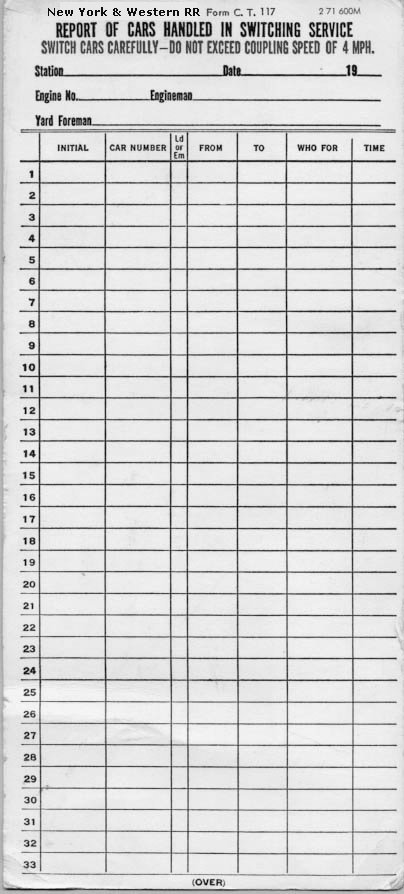
Identify the location of columns. The image size is (404, 894). (28, 148), (60, 148), (136, 150), (176, 145), (212, 150), (258, 148), (312, 144), (377, 150).